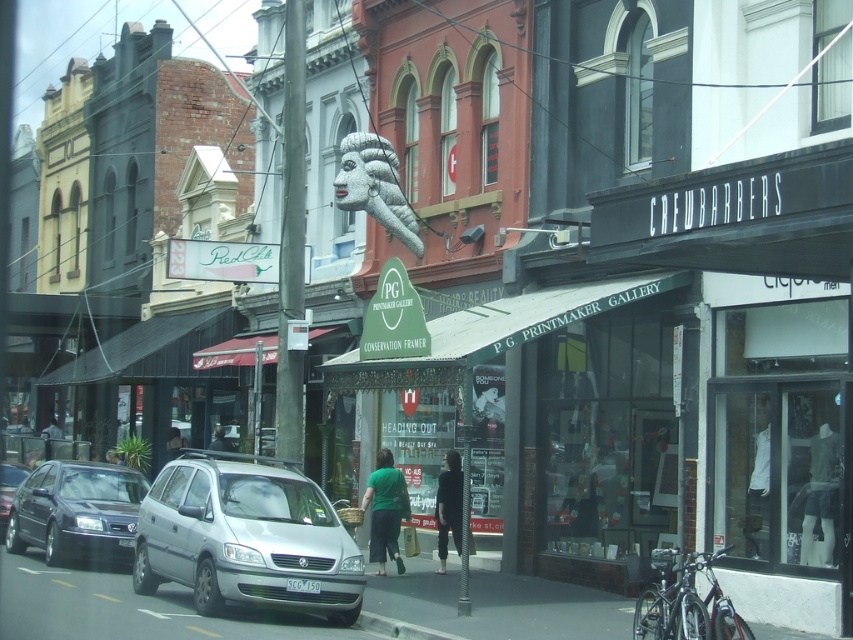
Who is taller, smooth gray pole at center or shiny silver sedan at left?

smooth gray pole at center is taller.

Does smooth gray pole at center lie in front of shiny silver sedan at left?

Yes.

Is point (297, 460) farther from camera compared to point (24, 474)?

No, (297, 460) is in front of (24, 474).

Where is `smooth gray pole at center`? The width and height of the screenshot is (853, 640). smooth gray pole at center is located at coordinates (291, 240).

Does silver metallic van at center appear under white textured sculpture at center?

Indeed, silver metallic van at center is positioned under white textured sculpture at center.

Consider the image. Measure the distance between point (173, 545) and camera.

A distance of 16.09 meters exists between point (173, 545) and camera.

Is point (276, 472) behind point (397, 204)?

No, it is not.

The width and height of the screenshot is (853, 640). What are the coordinates of `silver metallic van at center` in the screenshot? It's located at (247, 538).

Is gray concrete pavement at lower center above shiny silver sedan at left?

No, gray concrete pavement at lower center is not above shiny silver sedan at left.

Is point (15, 618) in front of point (16, 477)?

Yes, point (15, 618) is closer to viewer.

At what (x,y) coordinates should I click in order to perform the action: click on gray concrete pavement at lower center. Please return your answer as a coordinate pair (x, y). This screenshot has height=640, width=853. Looking at the image, I should click on (498, 605).